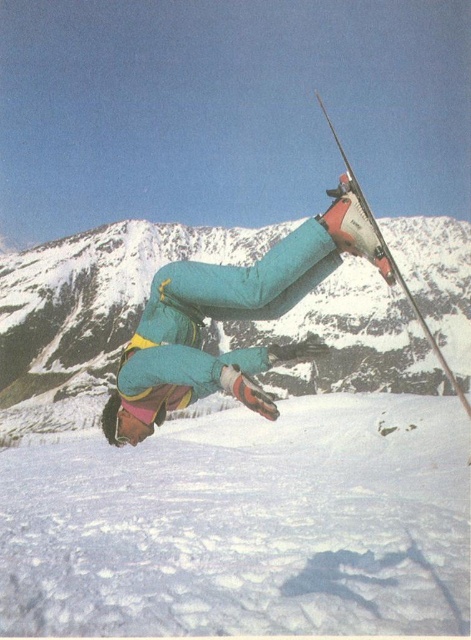
Question: Which point is farther to the camera?

Choices:
 (A) white powdery snow at lower center
 (B) matte red ski at upper right
 (C) teal matte snow pants at center

Answer: (A)

Question: Does teal matte snow pants at center have a larger size compared to matte red ski at upper right?

Choices:
 (A) yes
 (B) no

Answer: (B)

Question: Observing the image, what is the correct spatial positioning of white powdery snow at lower center in reference to matte red ski at upper right?

Choices:
 (A) left
 (B) right

Answer: (A)

Question: Can you confirm if teal matte snow pants at center is bigger than matte red ski at upper right?

Choices:
 (A) yes
 (B) no

Answer: (B)

Question: Which is farther from the matte red ski at upper right?

Choices:
 (A) teal matte snow pants at center
 (B) white powdery snow at lower center

Answer: (B)

Question: Considering the real-world distances, which object is closest to the white powdery snow at lower center?

Choices:
 (A) matte red ski at upper right
 (B) teal matte snow pants at center

Answer: (B)